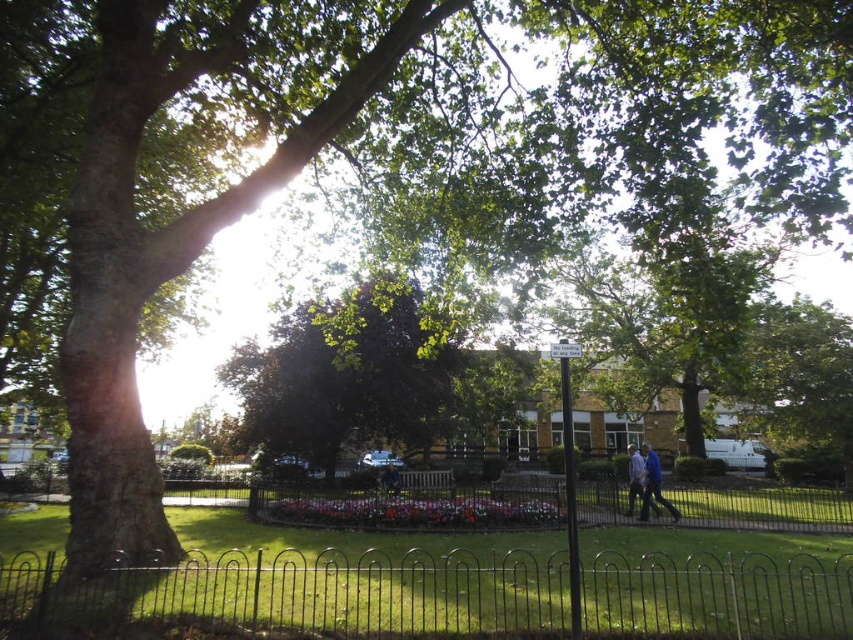
The height and width of the screenshot is (640, 853). What do you see at coordinates (653, 484) in the screenshot?
I see `blue fabric jacket at center` at bounding box center [653, 484].

What do you see at coordinates (653, 484) in the screenshot? This screenshot has height=640, width=853. I see `blue fabric jacket at center` at bounding box center [653, 484].

The height and width of the screenshot is (640, 853). I want to click on blue fabric jacket at center, so click(653, 484).

Which of these two, black metal fence at lower center or blue fabric jacket at center, stands taller?

With more height is blue fabric jacket at center.

Which is in front, point (274, 627) or point (648, 481)?

Point (274, 627) is in front.

At what (x,y) coordinates should I click in order to perform the action: click on black metal fence at lower center. Please return your answer as a coordinate pair (x, y). This screenshot has height=640, width=853. Looking at the image, I should click on (305, 593).

Between black metal fence at lower center and green leafy tree at center, which one is positioned higher?

green leafy tree at center is higher up.

Which is behind, point (73, 627) or point (408, 301)?

The point (408, 301) is behind.

You are a GUI agent. You are given a task and a screenshot of the screen. Output one action in this format:
    pyautogui.click(x=<x>, y=<y>)
    Task: Click on the black metal fence at lower center
    
    Given the screenshot: What is the action you would take?
    tap(305, 593)